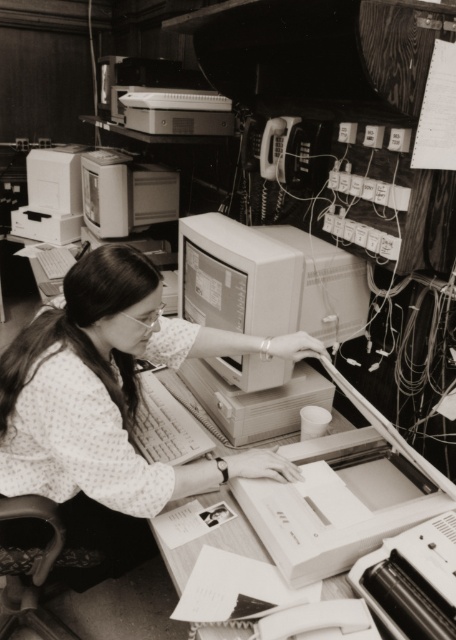
Question: Is matte gray monitor at center positioned in front of smooth white table at center?

Choices:
 (A) no
 (B) yes

Answer: (A)

Question: Estimate the real-world distances between objects in this image. Which object is closer to the polka dot fabric shirt at center?

Choices:
 (A) matte gray monitor at center
 (B) matte gray desktop computer at center
 (C) smooth white table at center

Answer: (C)

Question: Does smooth white table at center appear under matte gray desktop computer at center?

Choices:
 (A) yes
 (B) no

Answer: (A)

Question: Which of the following is the closest to the observer?

Choices:
 (A) (214, 250)
 (B) (124, 209)
 (C) (79, 323)

Answer: (C)

Question: Based on their relative distances, which object is nearer to the matte gray monitor at center?

Choices:
 (A) matte gray desktop computer at center
 (B) polka dot fabric shirt at center
 (C) smooth white table at center

Answer: (B)

Question: Considering the relative positions of polka dot fabric shirt at center and smooth white table at center in the image provided, where is polka dot fabric shirt at center located with respect to smooth white table at center?

Choices:
 (A) below
 (B) above

Answer: (B)